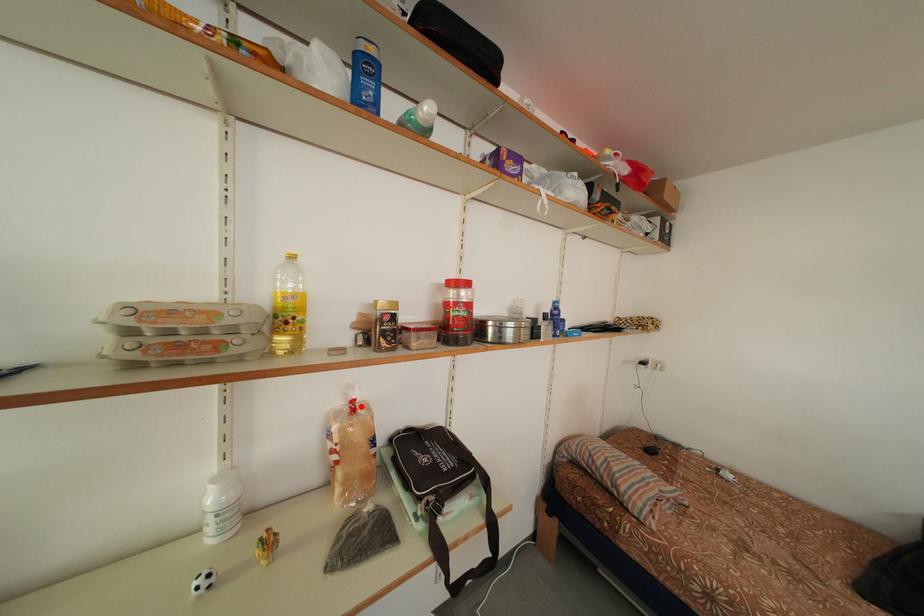
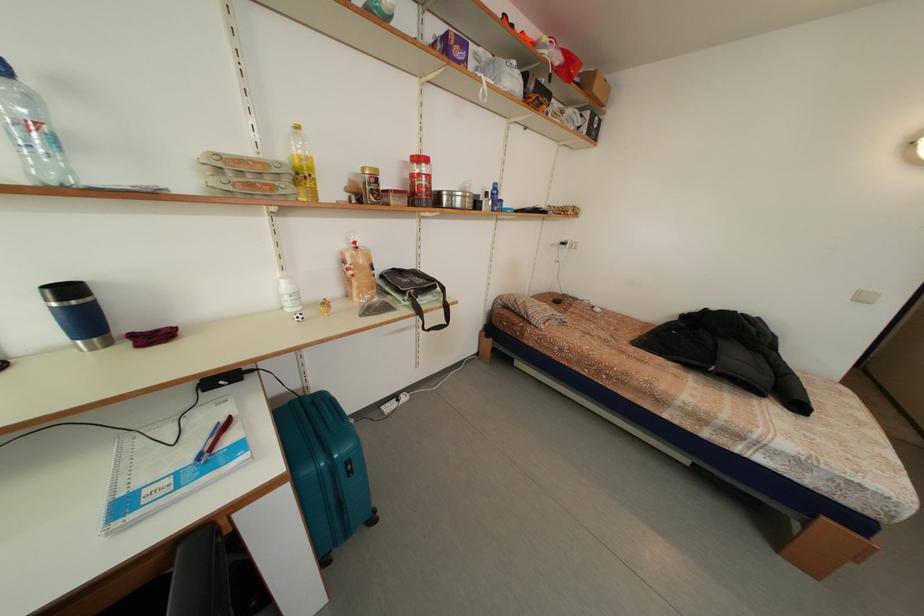
Question: I am providing you with two images of the same scene from different viewpoints. A red point is shown in image1. For the corresponding object point in image2, is it positioned nearer or farther from the camera?

Choices:
 (A) Nearer
 (B) Farther

Answer: (A)